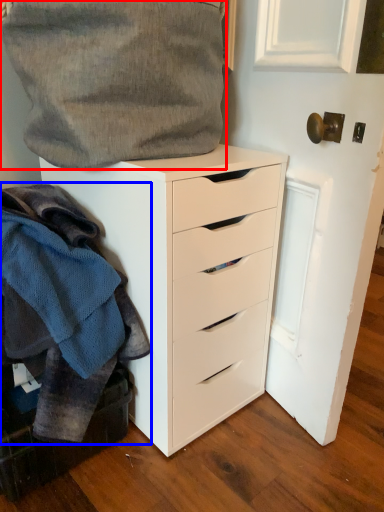
Question: Among these objects, which one is nearest to the camera, gray (highlighted by a red box) or clothing (highlighted by a blue box)?

Choices:
 (A) gray
 (B) clothing

Answer: (B)